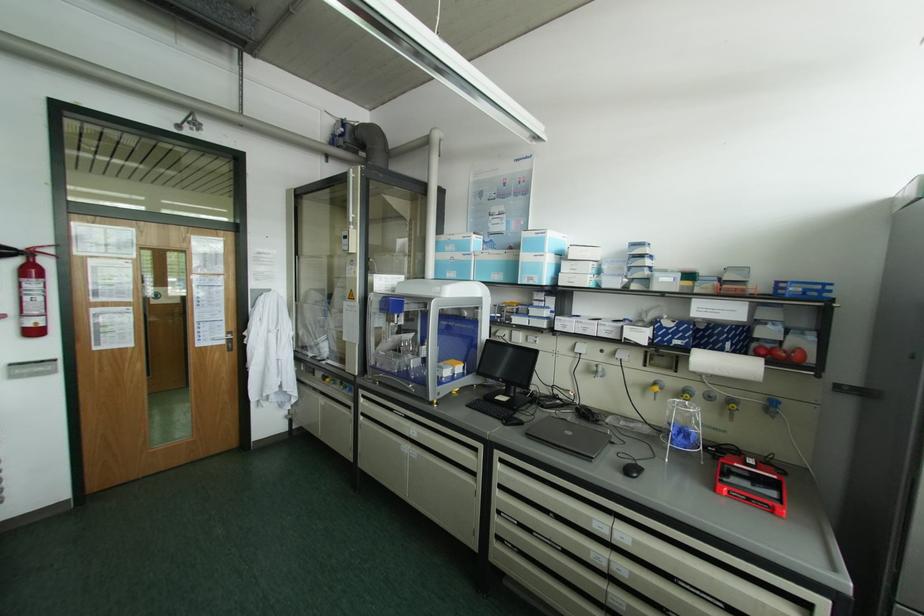
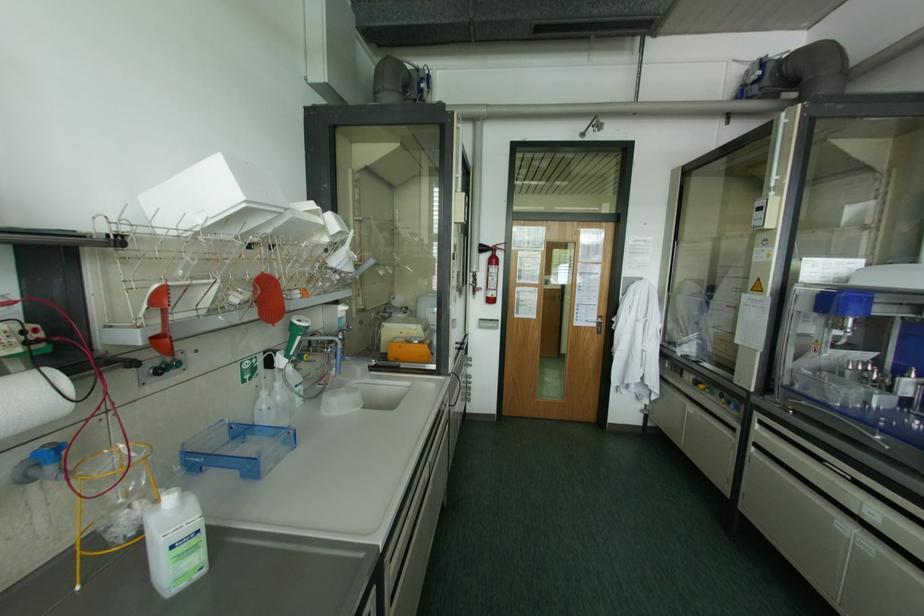
Question: Based on the continuous images, in which direction is the camera rotating? Reply with the corresponding letter.

Choices:
 (A) Left
 (B) Right
 (C) Up
 (D) Down

Answer: (A)